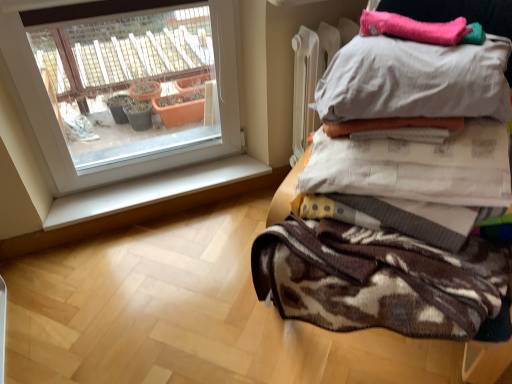
Question: Is pink fuzzy blanket at upper right, which appears as the first blanket when viewed from the top, inside white smooth window sill at lower left?

Choices:
 (A) yes
 (B) no

Answer: (B)

Question: Can you confirm if white smooth window sill at lower left is shorter than pink fuzzy blanket at upper right, which appears as the first blanket when viewed from the top?

Choices:
 (A) no
 (B) yes

Answer: (A)

Question: Is white smooth window sill at lower left in front of pink fuzzy blanket at upper right, which appears as the second blanket when ordered from the bottom?

Choices:
 (A) yes
 (B) no

Answer: (B)

Question: Can you confirm if white smooth window sill at lower left is bigger than pink fuzzy blanket at upper right, which appears as the second blanket when ordered from the bottom?

Choices:
 (A) yes
 (B) no

Answer: (A)

Question: Does white smooth window sill at lower left have a lesser width compared to pink fuzzy blanket at upper right, which appears as the second blanket when ordered from the bottom?

Choices:
 (A) yes
 (B) no

Answer: (B)

Question: From the image's perspective, is white smooth window sill at lower left above or below white cotton pillow at upper right?

Choices:
 (A) above
 (B) below

Answer: (B)

Question: In terms of height, does white smooth window sill at lower left look taller or shorter compared to white cotton pillow at upper right?

Choices:
 (A) short
 (B) tall

Answer: (A)

Question: From a real-world perspective, is white smooth window sill at lower left above or below white cotton pillow at upper right?

Choices:
 (A) below
 (B) above

Answer: (A)

Question: Would you say white smooth window sill at lower left is inside or outside white cotton pillow at upper right?

Choices:
 (A) outside
 (B) inside

Answer: (A)

Question: Based on their sizes in the image, would you say brown textured blanket at right is bigger or smaller than white smooth window sill at lower left?

Choices:
 (A) big
 (B) small

Answer: (A)

Question: Relative to white smooth window sill at lower left, is brown textured blanket at right in front or behind?

Choices:
 (A) front
 (B) behind

Answer: (A)

Question: Would you say brown textured blanket at right is inside or outside white smooth window sill at lower left?

Choices:
 (A) inside
 (B) outside

Answer: (B)

Question: From a real-world perspective, is brown textured blanket at right physically located above or below white smooth window sill at lower left?

Choices:
 (A) above
 (B) below

Answer: (A)

Question: Do you think brown textured blanket at upper right, positioned as the first blanket in bottom-to-top order, is within brown textured blanket at upper right, or outside of it?

Choices:
 (A) outside
 (B) inside

Answer: (B)

Question: From the image's perspective, is brown textured blanket at upper right, positioned as the first blanket in bottom-to-top order, positioned above or below brown textured blanket at upper right?

Choices:
 (A) above
 (B) below

Answer: (A)